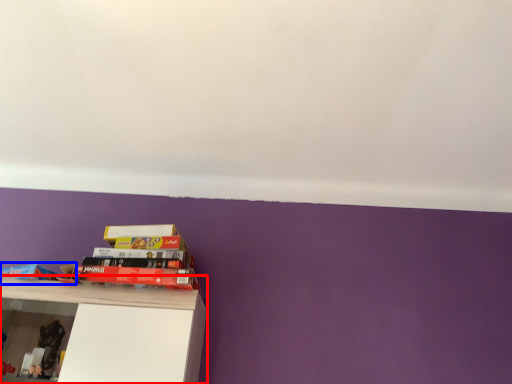
Question: Which object is closer to the camera taking this photo, shelf (highlighted by a red box) or book (highlighted by a blue box)?

Choices:
 (A) shelf
 (B) book

Answer: (A)